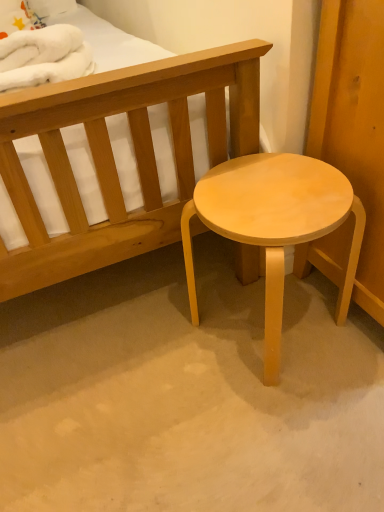
Image resolution: width=384 pixels, height=512 pixels. What do you see at coordinates (273, 224) in the screenshot?
I see `light wood stool at center` at bounding box center [273, 224].

In order to face light wood stool at center, should I rotate leftwards or rightwards?

You should look right and rotate roughly 10.268 degrees.

Identify the location of light wood stool at center. (273, 224).

You are a GUI agent. You are given a task and a screenshot of the screen. Output one action in this format:
    pyautogui.click(x=<x>, y=<y>)
    Task: Click on the light wood stool at center
    This screenshot has width=384, height=512.
    Given the screenshot: What is the action you would take?
    pyautogui.click(x=273, y=224)